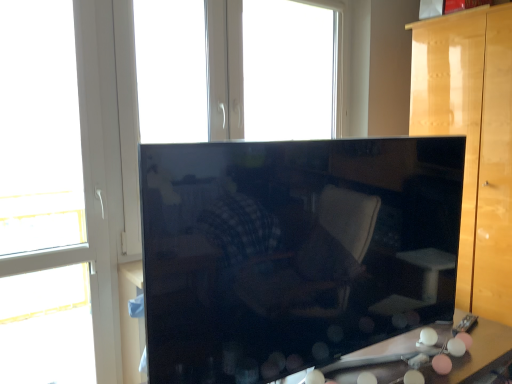
Question: Is white plastic window at upper center, which is the second window in front-to-back order, positioned with its back to white plastic window at left, which ranks as the second window in right-to-left order?

Choices:
 (A) no
 (B) yes

Answer: (A)

Question: From the image's perspective, is white plastic window at upper center, placed as the first window when sorted from right to left, on white plastic window at left, the 1th window from the left?

Choices:
 (A) yes
 (B) no

Answer: (A)

Question: Is white plastic window at upper center, the 1th window from the back, outside white plastic window at left, which ranks as the second window in right-to-left order?

Choices:
 (A) no
 (B) yes

Answer: (B)

Question: Does white plastic window at upper center, the 2th window when ordered from left to right, appear on the left side of white plastic window at left, which is the 2th window in back-to-front order?

Choices:
 (A) yes
 (B) no

Answer: (B)

Question: Is white plastic window at upper center, the 1th window from the back, behind white plastic window at left, which ranks as the second window in right-to-left order?

Choices:
 (A) no
 (B) yes

Answer: (B)

Question: Considering the positions of glossy wood cabinet at right and glossy wood cabinet at center in the image, is glossy wood cabinet at right taller or shorter than glossy wood cabinet at center?

Choices:
 (A) tall
 (B) short

Answer: (A)

Question: Does point (435, 62) appear closer or farther from the camera than point (283, 183)?

Choices:
 (A) closer
 (B) farther

Answer: (B)

Question: Looking at their shapes, would you say glossy wood cabinet at right is wider or thinner than glossy wood cabinet at center?

Choices:
 (A) thin
 (B) wide

Answer: (A)

Question: From a real-world perspective, is glossy wood cabinet at right above or below glossy wood cabinet at center?

Choices:
 (A) above
 (B) below

Answer: (A)

Question: Considering the positions of point (118, 203) and point (446, 216), is point (118, 203) closer or farther from the camera than point (446, 216)?

Choices:
 (A) closer
 (B) farther

Answer: (B)

Question: From a real-world perspective, relative to glossy wood cabinet at center, is white plastic window at left, the 1th window from the left, vertically above or below?

Choices:
 (A) below
 (B) above

Answer: (B)

Question: Is white plastic window at left, the first window when ordered from front to back, wider or thinner than glossy wood cabinet at center?

Choices:
 (A) wide
 (B) thin

Answer: (B)

Question: Would you say white plastic window at left, the first window when ordered from front to back, is to the left or to the right of glossy wood cabinet at center in the picture?

Choices:
 (A) left
 (B) right

Answer: (A)

Question: Is glossy wood cabinet at right taller or shorter than white plastic window at upper center, the 1th window from the back?

Choices:
 (A) short
 (B) tall

Answer: (B)

Question: Is point (482, 19) positioned closer to the camera than point (304, 119)?

Choices:
 (A) closer
 (B) farther

Answer: (A)